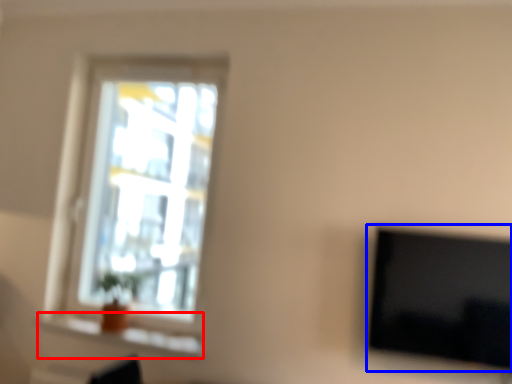
Question: Which object is further to the camera taking this photo, window sill (highlighted by a red box) or television (highlighted by a blue box)?

Choices:
 (A) window sill
 (B) television

Answer: (A)